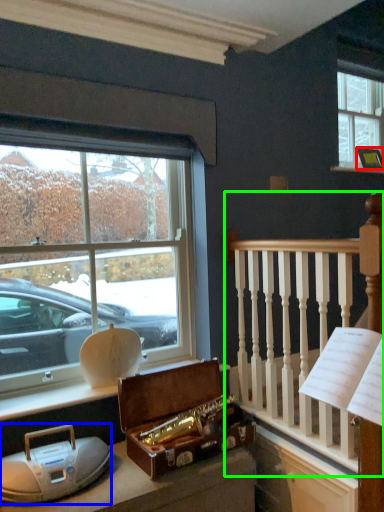
Question: Which object is positioned closest to picture frame (highlighted by a red box)? Select from artifact (highlighted by a blue box) and rail (highlighted by a green box).

Choices:
 (A) artifact
 (B) rail

Answer: (B)